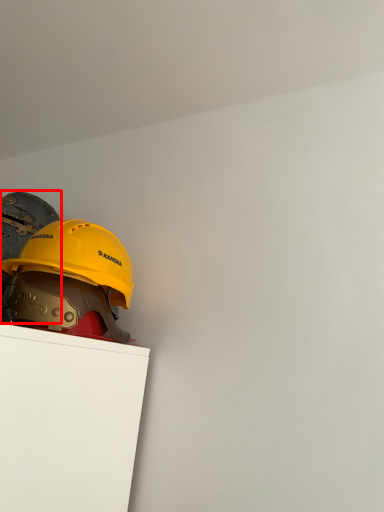
Question: From the image's perspective, considering the relative positions of helmet (annotated by the red box) and helmet in the image provided, where is helmet (annotated by the red box) located with respect to the staircase?

Choices:
 (A) above
 (B) below

Answer: (A)